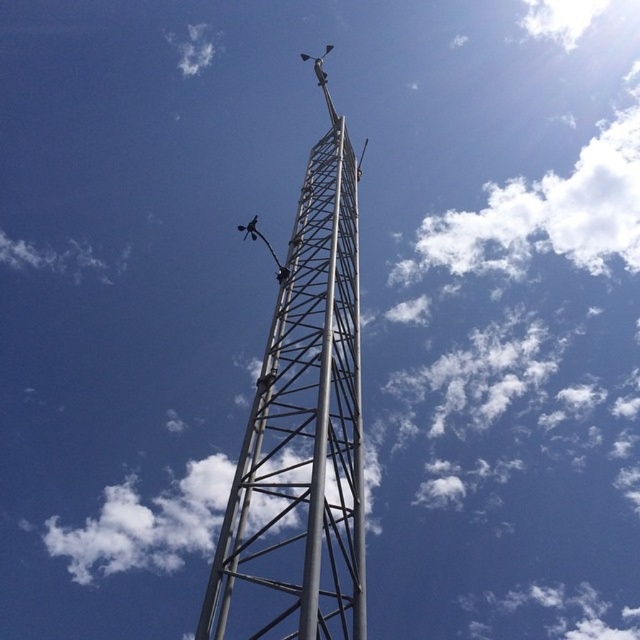
You are standing in a field and see the silver metallic tower at center and the white fluffy cloud at upper center. Which object is closer to you?

The silver metallic tower at center is closer to you because it is in front of the white fluffy cloud at upper center.

Looking at the image, there is a silver metallic tower at center and a white fluffy cloud at upper center. Which object is closer to the top of the image?

The white fluffy cloud at upper center is closer to the top of the image because it is positioned above the silver metallic tower at center.

You are standing at the base of the silver metallic tower at center. Looking up, you notice a point marked at coordinates point (301, 433). Where is this point located on the tower?

The point (301, 433) is located at the center of the silver metallic tower at center.